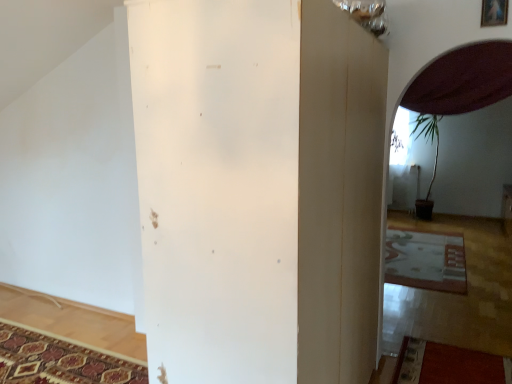
Question: Does patterned carpet at lower right, acting as the 1th mat starting from the back, have a lesser width compared to white matte pillar at center?

Choices:
 (A) yes
 (B) no

Answer: (B)

Question: Is patterned carpet at lower right, which is the 2th mat in front-to-back order, closer to the viewer compared to white matte pillar at center?

Choices:
 (A) yes
 (B) no

Answer: (B)

Question: Is patterned carpet at lower right, positioned as the second mat in left-to-right order, next to white matte pillar at center and touching it?

Choices:
 (A) no
 (B) yes

Answer: (A)

Question: From the image's perspective, is patterned carpet at lower right, acting as the 1th mat starting from the back, located above white matte pillar at center?

Choices:
 (A) yes
 (B) no

Answer: (B)

Question: Is patterned carpet at lower right, acting as the 1th mat starting from the back, taller than white matte pillar at center?

Choices:
 (A) yes
 (B) no

Answer: (B)

Question: Is patterned carpet at lower right, the 1th mat when ordered from top to bottom, not close to white matte pillar at center?

Choices:
 (A) no
 (B) yes

Answer: (B)

Question: Considering the relative sizes of wooden picture frame at upper right and patterned carpet at lower left, acting as the second mat starting from the right, in the image provided, is wooden picture frame at upper right thinner than patterned carpet at lower left, acting as the second mat starting from the right,?

Choices:
 (A) no
 (B) yes

Answer: (B)

Question: Does wooden picture frame at upper right have a greater height compared to patterned carpet at lower left, acting as the second mat starting from the right?

Choices:
 (A) no
 (B) yes

Answer: (B)

Question: From a real-world perspective, is wooden picture frame at upper right located beneath patterned carpet at lower left, which is counted as the 2th mat, starting from the top?

Choices:
 (A) no
 (B) yes

Answer: (A)

Question: Could you tell me if wooden picture frame at upper right is facing patterned carpet at lower left, which ranks as the 1th mat in front-to-back order?

Choices:
 (A) no
 (B) yes

Answer: (A)

Question: Does wooden picture frame at upper right have a larger size compared to patterned carpet at lower left, marked as the first mat in a bottom-to-top arrangement?

Choices:
 (A) yes
 (B) no

Answer: (B)

Question: Can you confirm if wooden picture frame at upper right is shorter than patterned carpet at lower left, marked as the first mat in a bottom-to-top arrangement?

Choices:
 (A) no
 (B) yes

Answer: (A)

Question: From a real-world perspective, is patterned carpet at lower left, marked as the first mat in a bottom-to-top arrangement, on wooden picture frame at upper right?

Choices:
 (A) yes
 (B) no

Answer: (B)